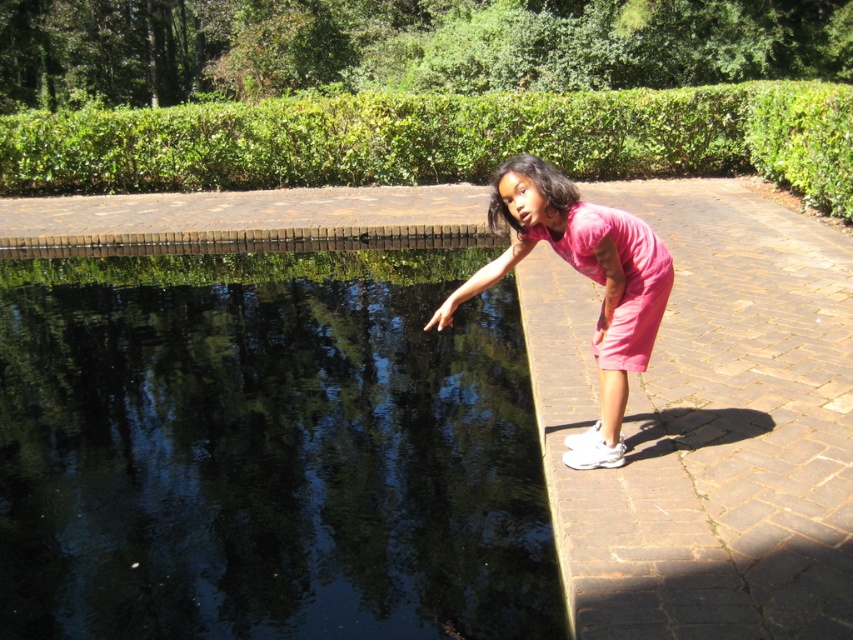
Question: Can you confirm if black smooth water at center is thinner than pink fabric dress at right?

Choices:
 (A) yes
 (B) no

Answer: (A)

Question: Among these points, which one is farthest from the camera?

Choices:
 (A) (662, 296)
 (B) (416, 289)
 (C) (618, 312)

Answer: (B)

Question: Does black smooth water at center have a greater width compared to pink fabric dress at right?

Choices:
 (A) yes
 (B) no

Answer: (B)

Question: Where is black smooth water at center located in relation to pink fabric dress at right in the image?

Choices:
 (A) right
 (B) left

Answer: (B)

Question: Considering the real-world distances, which object is closest to the pink matte dress at right?

Choices:
 (A) black smooth water at center
 (B) pink fabric dress at right

Answer: (B)

Question: Which point is closer to the camera taking this photo?

Choices:
 (A) (631, 285)
 (B) (608, 232)

Answer: (B)